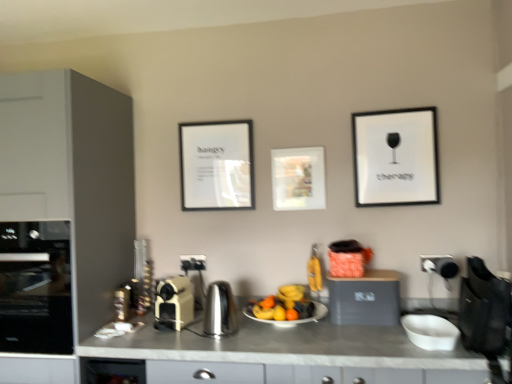
What do you see at coordinates (35, 288) in the screenshot?
I see `black glass oven at left` at bounding box center [35, 288].

This screenshot has height=384, width=512. Describe the element at coordinates (193, 262) in the screenshot. I see `matte black toaster at center, the 1th electric outlet in the left-to-right sequence` at that location.

What is the approximate height of beige plastic coffee machine at center?

beige plastic coffee machine at center is 10.21 inches in height.

Where is `metallic stainless steel countertop at center`? The height and width of the screenshot is (384, 512). metallic stainless steel countertop at center is located at coordinates (285, 346).

You are a GUI agent. You are given a task and a screenshot of the screen. Output one action in this format:
    pyautogui.click(x=<x>, y=<y>)
    Task: Click on the matte gray toaster at center, placed as the first cabinetry when sorted from right to left
    The height and width of the screenshot is (384, 512).
    Given the screenshot: What is the action you would take?
    tap(365, 298)

The height and width of the screenshot is (384, 512). Describe the element at coordinates (72, 178) in the screenshot. I see `matte gray cabinet at left, which is the second cabinetry from right to left` at that location.

Locate an element on the screen. The height and width of the screenshot is (384, 512). black glass oven at left is located at coordinates (35, 288).

Identify the location of countertop in front of the black glass oven at left. Image resolution: width=512 pixels, height=384 pixels. (285, 346).

Is there a large distance between black glass oven at left and metallic stainless steel countertop at center?

black glass oven at left is actually quite close to metallic stainless steel countertop at center.

From a real-world perspective, is black glass oven at left positioned over metallic stainless steel countertop at center based on gravity?

Yes, from a real-world perspective, black glass oven at left is over metallic stainless steel countertop at center

Does black glass oven at left turn towards metallic stainless steel countertop at center?

No, black glass oven at left is not turned towards metallic stainless steel countertop at center.

Does matte glass picture frame at center, which ranks as the 2th picture frame in left-to-right order, have a greater width compared to black glass oven at left?

In fact, matte glass picture frame at center, which ranks as the 2th picture frame in left-to-right order, might be narrower than black glass oven at left.

Looking at this image, from a real-world perspective, between matte glass picture frame at center, marked as the second picture frame in a back-to-front arrangement, and black glass oven at left, who is vertically lower?

black glass oven at left, from a real-world perspective.

How many degrees apart are the facing directions of matte glass picture frame at center, which ranks as the 2th picture frame in left-to-right order, and black glass oven at left?

0.505 degrees separate the facing orientations of matte glass picture frame at center, which ranks as the 2th picture frame in left-to-right order, and black glass oven at left.

Based on the photo, can you confirm if matte glass picture frame at center, marked as the second picture frame in a back-to-front arrangement, is positioned to the left of black glass oven at left?

No.

Which is behind, point (69, 313) or point (399, 134)?

Positioned behind is point (399, 134).

Is black glass oven at left placed right next to black matte picture frame at upper right, which is the first picture frame in front-to-back order?

No, black glass oven at left is not in contact with black matte picture frame at upper right, which is the first picture frame in front-to-back order.

Between black glass oven at left and black matte picture frame at upper right, which is the third picture frame in back-to-front order, which one has larger size?

Bigger between the two is black glass oven at left.

Based on the photo, from a real-world perspective, is black glass oven at left physically below black matte picture frame at upper right, which is the third picture frame in back-to-front order?

Yes.

Is matte black toaster at center, marked as the first electric outlet in a back-to-front arrangement, surrounded by white plastic electric outlet at right, the second electric outlet from the left?

That's incorrect, matte black toaster at center, marked as the first electric outlet in a back-to-front arrangement, is not inside white plastic electric outlet at right, the second electric outlet from the left.

Is white plastic electric outlet at right, which appears as the first electric outlet when viewed from the right, at the left side of matte black toaster at center, the 1th electric outlet in the left-to-right sequence?

In fact, white plastic electric outlet at right, which appears as the first electric outlet when viewed from the right, is to the right of matte black toaster at center, the 1th electric outlet in the left-to-right sequence.

Does white plastic electric outlet at right, which appears as the first electric outlet when viewed from the right, touch matte black toaster at center, the 1th electric outlet in the left-to-right sequence?

No, white plastic electric outlet at right, which appears as the first electric outlet when viewed from the right, is not in contact with matte black toaster at center, the 1th electric outlet in the left-to-right sequence.

Is white plastic electric outlet at right, arranged as the first electric outlet when viewed from the front, not near matte gray toaster at center, placed as the 2th cabinetry when sorted from top to bottom?

Actually, white plastic electric outlet at right, arranged as the first electric outlet when viewed from the front, and matte gray toaster at center, placed as the 2th cabinetry when sorted from top to bottom, are a little close together.

Which object is positioned more to the left, white plastic electric outlet at right, the second electric outlet from the left, or matte gray toaster at center, which is counted as the 1th cabinetry, starting from the bottom?

Positioned to the left is matte gray toaster at center, which is counted as the 1th cabinetry, starting from the bottom.

In terms of width, does white plastic electric outlet at right, arranged as the first electric outlet when viewed from the front, look wider or thinner when compared to matte gray toaster at center, arranged as the 2th cabinetry when viewed from the left?

white plastic electric outlet at right, arranged as the first electric outlet when viewed from the front, is thinner than matte gray toaster at center, arranged as the 2th cabinetry when viewed from the left.

You are a GUI agent. You are given a task and a screenshot of the screen. Output one action in this format:
    pyautogui.click(x=<x>, y=<y>)
    Task: Click on the cabinetry below the white plastic electric outlet at right, the 2th electric outlet when ordered from back to front (from the image's perspective)
    This screenshot has height=384, width=512.
    Given the screenshot: What is the action you would take?
    pyautogui.click(x=365, y=298)

Does metallic stainless steel countertop at center have a lesser height compared to white plastic electric outlet at right, arranged as the first electric outlet when viewed from the front?

No, metallic stainless steel countertop at center is not shorter than white plastic electric outlet at right, arranged as the first electric outlet when viewed from the front.

Is metallic stainless steel countertop at center beside white plastic electric outlet at right, which appears as the first electric outlet when viewed from the right?

No, metallic stainless steel countertop at center is not next to white plastic electric outlet at right, which appears as the first electric outlet when viewed from the right.

Visually, is metallic stainless steel countertop at center positioned to the left or to the right of white plastic electric outlet at right, arranged as the first electric outlet when viewed from the front?

metallic stainless steel countertop at center is positioned on white plastic electric outlet at right, arranged as the first electric outlet when viewed from the front,'s left side.

Based on the photo, from a real-world perspective, is metallic stainless steel countertop at center located higher than white plastic electric outlet at right, the 2th electric outlet when ordered from back to front?

No.

Which of these two, black glass oven at left or matte gray toaster at center, placed as the 2th cabinetry when sorted from top to bottom, stands shorter?

With less height is matte gray toaster at center, placed as the 2th cabinetry when sorted from top to bottom.

Is black glass oven at left touching matte gray toaster at center, which is counted as the 1th cabinetry, starting from the bottom?

No, black glass oven at left is not in contact with matte gray toaster at center, which is counted as the 1th cabinetry, starting from the bottom.

From the image's perspective, which one is positioned higher, black glass oven at left or matte gray toaster at center, placed as the 2th cabinetry when sorted from top to bottom?

black glass oven at left.

Locate an element on the screen. This screenshot has width=512, height=384. home appliance above the metallic stainless steel countertop at center (from a real-world perspective) is located at coordinates (35, 288).

The height and width of the screenshot is (384, 512). I want to click on home appliance that appears below the matte glass picture frame at center, marked as the second picture frame in a back-to-front arrangement (from a real-world perspective), so click(x=35, y=288).

Based on their spatial positions, is black matte picture frame at upper right, which is the third picture frame in back-to-front order, or matte glass picture frame at center, positioned as the 2th picture frame in right-to-left order, further from white plastic electric outlet at right, the second electric outlet from the left?

matte glass picture frame at center, positioned as the 2th picture frame in right-to-left order, is further to white plastic electric outlet at right, the second electric outlet from the left.

Which object lies nearer to the anchor point matte gray toaster at center, placed as the 2th cabinetry when sorted from top to bottom, white glossy plate at center or white matte bowl at lower right?

white glossy plate at center is closer to matte gray toaster at center, placed as the 2th cabinetry when sorted from top to bottom.

In the scene shown: From the image, which object appears to be farther from matte gray cabinet at left, acting as the first cabinetry starting from the top, matte black picture frame at center, placed as the 3th picture frame when sorted from front to back, or white plastic electric outlet at right, the second electric outlet from the left?

white plastic electric outlet at right, the second electric outlet from the left, lies further to matte gray cabinet at left, acting as the first cabinetry starting from the top, than the other object.

Looking at the image, which one is located further to white matte bowl at lower right, matte gray cabinet at left, the 1th cabinetry in the left-to-right sequence, or black matte picture frame at upper right, the third picture frame from the left?

The object further to white matte bowl at lower right is matte gray cabinet at left, the 1th cabinetry in the left-to-right sequence.

From the picture: Which object lies further to the anchor point matte black toaster at center, marked as the first electric outlet in a back-to-front arrangement, matte black picture frame at center, which is counted as the first picture frame, starting from the left, or white matte bowl at lower right?

white matte bowl at lower right.

Which object lies nearer to the anchor point beige plastic coffee machine at center, matte black toaster at center, marked as the first electric outlet in a back-to-front arrangement, or matte gray toaster at center, arranged as the 2th cabinetry when viewed from the left?

The object closer to beige plastic coffee machine at center is matte black toaster at center, marked as the first electric outlet in a back-to-front arrangement.

From the picture: Considering their positions, is metallic stainless steel countertop at center positioned closer to matte black toaster at center, the 2th electric outlet when ordered from right to left, than black matte picture frame at upper right, which is the first picture frame in front-to-back order?

metallic stainless steel countertop at center is positioned closer to the anchor matte black toaster at center, the 2th electric outlet when ordered from right to left.

From the image, which object appears to be nearer to black matte picture frame at upper right, which appears as the 1th picture frame when viewed from the right, matte black toaster at center, the 2th electric outlet when ordered from right to left, or white plastic electric outlet at right, which appears as the first electric outlet when viewed from the right?

The object closer to black matte picture frame at upper right, which appears as the 1th picture frame when viewed from the right, is white plastic electric outlet at right, which appears as the first electric outlet when viewed from the right.

Identify the location of cabinetry located between beige plastic coffee machine at center and black matte picture frame at upper right, which is the first picture frame in front-to-back order, in the left-right direction. (365, 298).

Locate an element on the screen. bowl between black matte picture frame at upper right, which appears as the 1th picture frame when viewed from the right, and metallic stainless steel countertop at center vertically is located at coordinates (430, 332).

Identify the location of home appliance between matte gray cabinet at left, arranged as the second cabinetry when ordered from the bottom, and white matte bowl at lower right. (35, 288).

What are the coordinates of `kitchen appliance between matte gray cabinet at left, the 1th cabinetry in the left-to-right sequence, and matte glass picture frame at center, positioned as the 2th picture frame in right-to-left order, in the horizontal direction` in the screenshot? It's located at (174, 303).